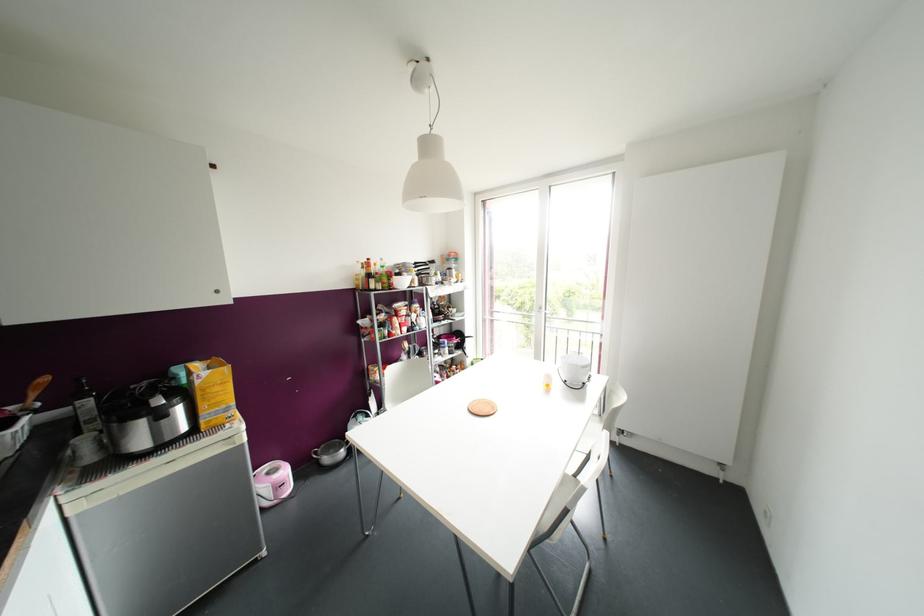
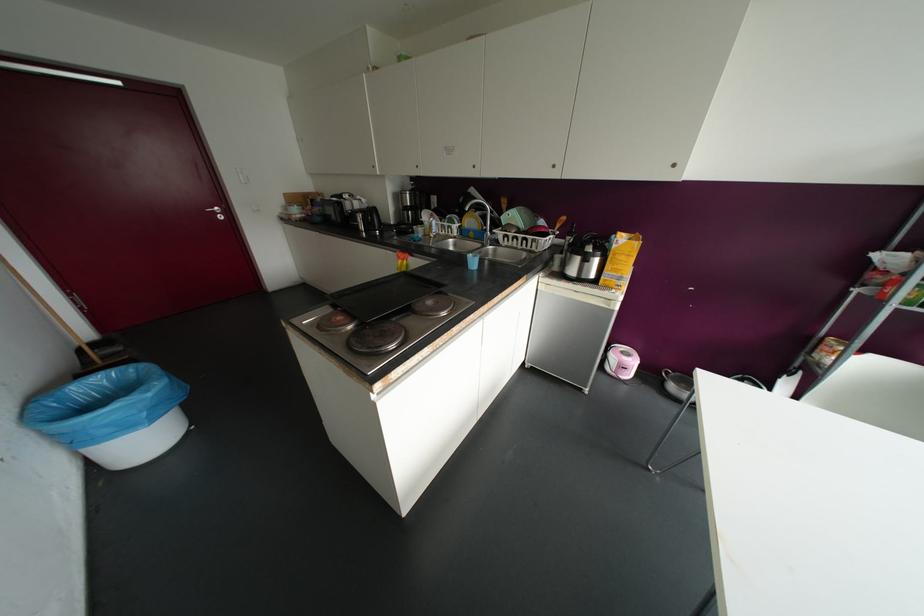
In the second image, find the point that corresponds to [152,395] in the first image.

(589, 244)